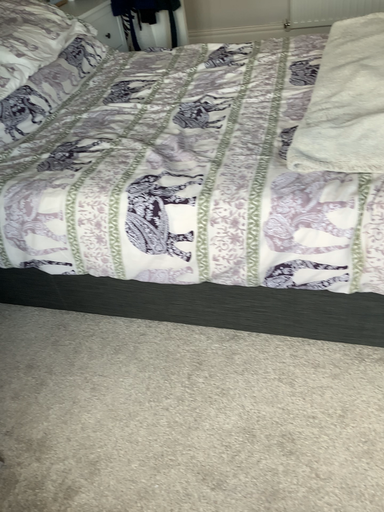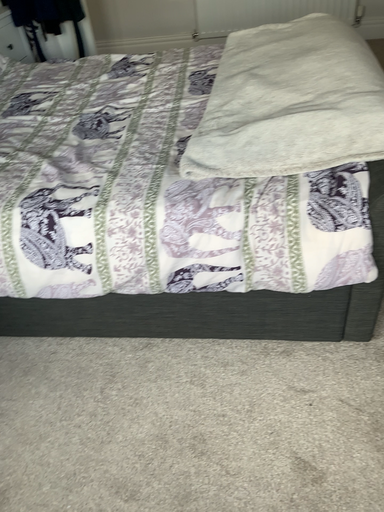
Question: Which way did the camera rotate in the video?

Choices:
 (A) rotated right
 (B) rotated left

Answer: (A)